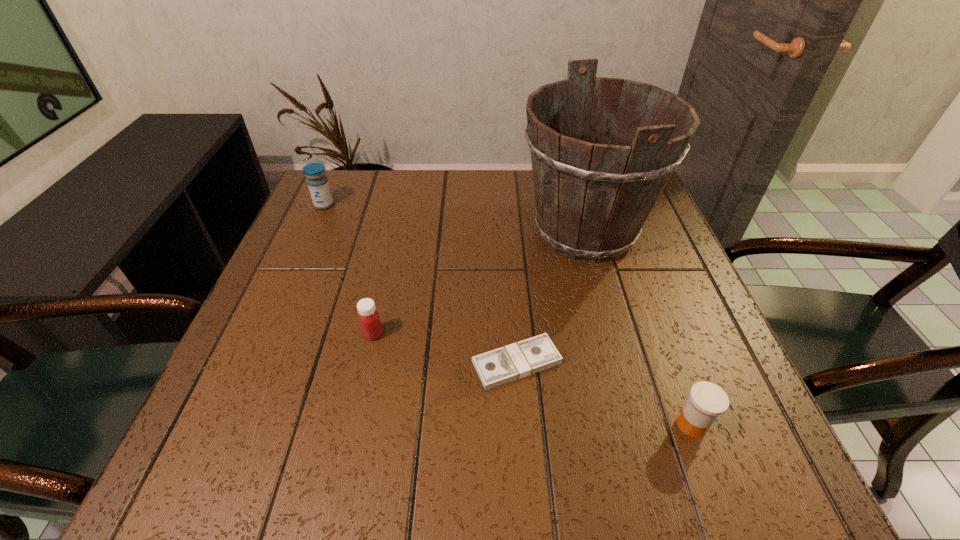
Where is `blank area located 0.240m on the right of the second object from left to right`? This screenshot has height=540, width=960. blank area located 0.240m on the right of the second object from left to right is located at coordinates (507, 334).

Find the location of a particular element. vacant area situated on the label of the nearest medicine is located at coordinates (485, 425).

What are the coordinates of `blank space located 0.340m on the label of the nearest medicine` in the screenshot? It's located at [467, 425].

Where is `blank area located on the label of the nearest medicine`? blank area located on the label of the nearest medicine is located at coordinates (564, 425).

The height and width of the screenshot is (540, 960). I want to click on free space located on the front of the shortest object, so click(x=524, y=466).

What are the coordinates of `bucket that is positioned at the far edge` in the screenshot? It's located at (592, 199).

The image size is (960, 540). Identify the location of medicine that is at the far edge. (318, 184).

Where is `object at the near edge`? object at the near edge is located at coordinates (707, 401).

Image resolution: width=960 pixels, height=540 pixels. What are the coordinates of `object situated at the left edge` in the screenshot? It's located at click(318, 184).

Locate an element on the screen. bucket that is at the right edge is located at coordinates (592, 199).